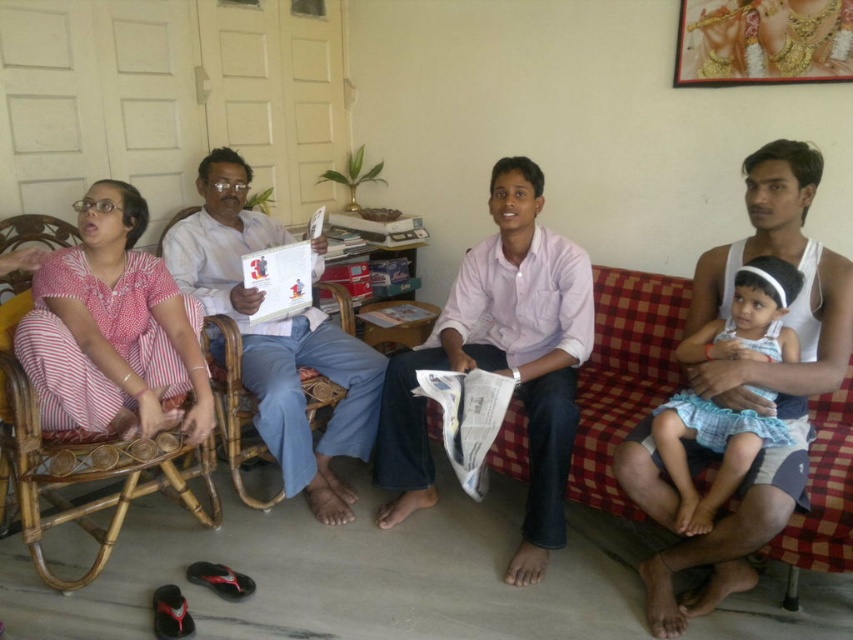
Question: Is pink striped dress at left thinner than white paper book at center?

Choices:
 (A) yes
 (B) no

Answer: (A)

Question: Does pink striped dress at left come in front of light blue cotton dress at right?

Choices:
 (A) yes
 (B) no

Answer: (B)

Question: Among these objects, which one is nearest to the camera?

Choices:
 (A) pink striped dress at left
 (B) light blue cotton dress at right
 (C) white paper book at center

Answer: (B)

Question: In this image, where is pink striped dress at left located relative to white paper book at center?

Choices:
 (A) right
 (B) left

Answer: (B)

Question: Which object is farther from the camera taking this photo?

Choices:
 (A) white paper book at center
 (B) pink striped dress at left
 (C) light blue cotton dress at right

Answer: (A)

Question: Considering the real-world distances, which object is closest to the pink striped dress at left?

Choices:
 (A) light blue cotton dress at right
 (B) white paper book at center

Answer: (B)